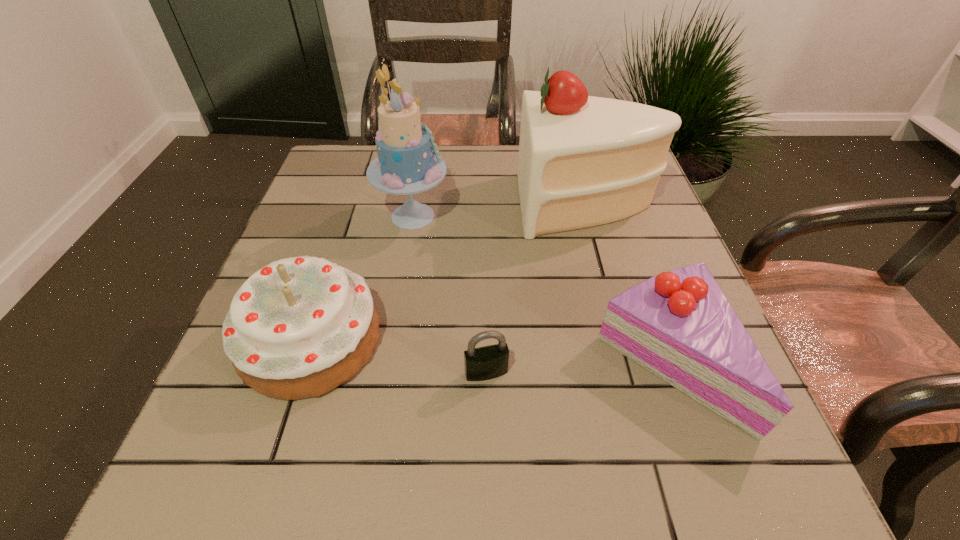
This screenshot has height=540, width=960. Identify the location of the fourth tallest object. (679, 325).

Identify the location of the shortest object. (488, 362).

The width and height of the screenshot is (960, 540). Find the location of `padlock`. padlock is located at coordinates tap(488, 362).

The image size is (960, 540). Find the location of `vacant space located 0.230m on the back of the shortest cake`. vacant space located 0.230m on the back of the shortest cake is located at coordinates (618, 227).

This screenshot has width=960, height=540. Identify the location of free space located 0.200m on the left of the third object from right to left. (350, 373).

This screenshot has height=540, width=960. What are the coordinates of `object that is at the far edge` in the screenshot? It's located at (584, 161).

The width and height of the screenshot is (960, 540). What are the coordinates of `object present at the near edge` in the screenshot? It's located at (679, 325).

The height and width of the screenshot is (540, 960). Identify the location of object at the left edge. pyautogui.click(x=299, y=327).

Find the location of `object at the far right corner`. object at the far right corner is located at coordinates pyautogui.click(x=584, y=161).

Identify the location of object that is at the near right corner. This screenshot has width=960, height=540. (679, 325).